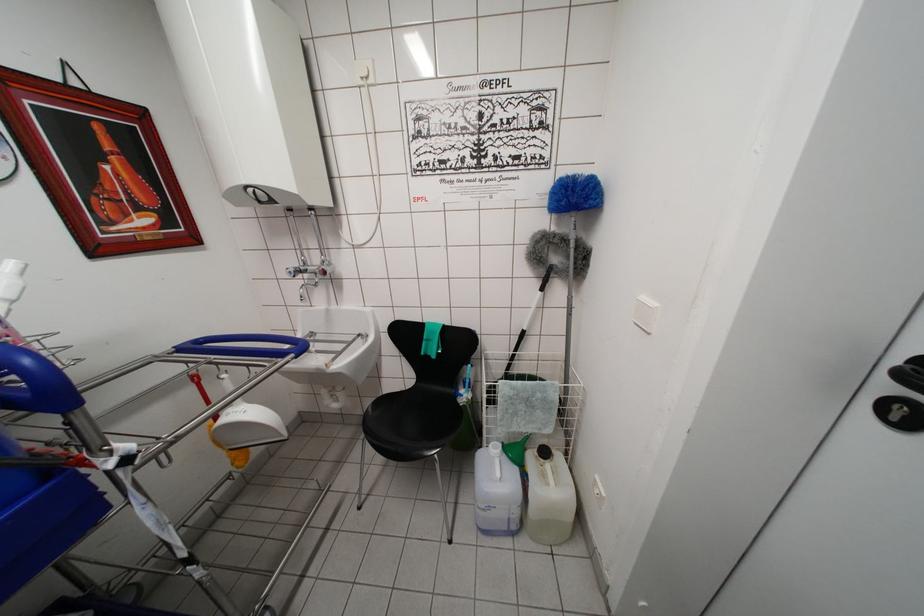
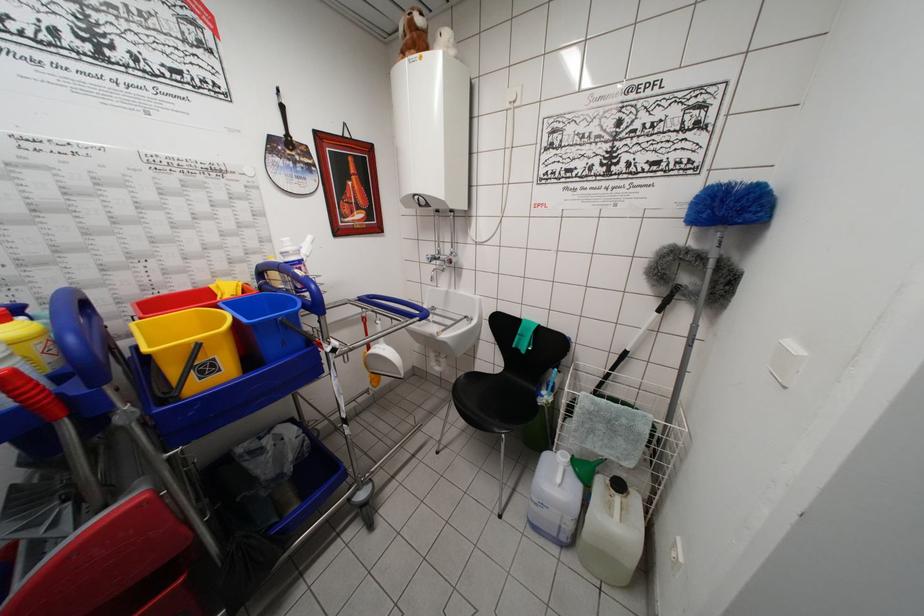
Where in the second image is the point corresponding to point (508, 448) from the first image?

(579, 462)